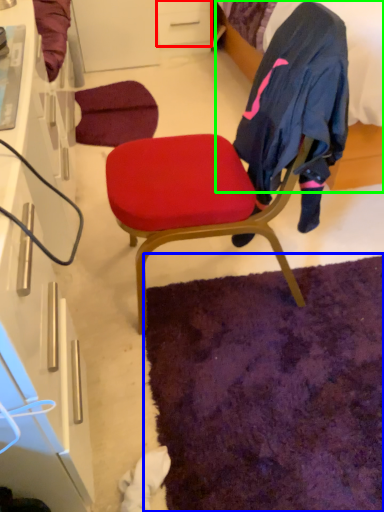
Question: Which is nearer to the drawer (highlighted by a red box)? mat (highlighted by a blue box) or bed (highlighted by a green box).

Choices:
 (A) mat
 (B) bed

Answer: (B)